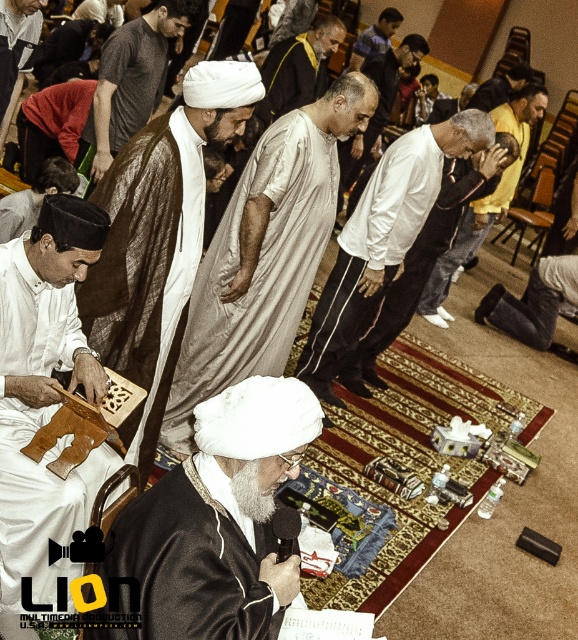
You are a photographer taking a picture of the prayer session. You want to ensure that both the matte brown wooden prayer board at left and the white satin robe at center are clearly visible in the frame. Which object should you focus on first to ensure it is in focus, given their heights?

The matte brown wooden prayer board at left is not as tall as the white satin robe at center, so you should focus on the white satin robe at center first since it is taller and might be more prominent in the composition.

You are standing in the room where the prayer session is taking place. You see the point marked at coordinate (46, 401). What object is located at that point?

The point at coordinate (46, 401) marks the location of the matte brown wooden prayer board at left.

You are part of the prayer group and need to retrieve your tissue. You are currently standing near the white satin robe at center. Which direction should you move to reach the tissue located near the matte brown wooden prayer board at left?

The matte brown wooden prayer board at left is to the left of the white satin robe at center, so you should move to your left to reach the tissue near the matte brown wooden prayer board at left.